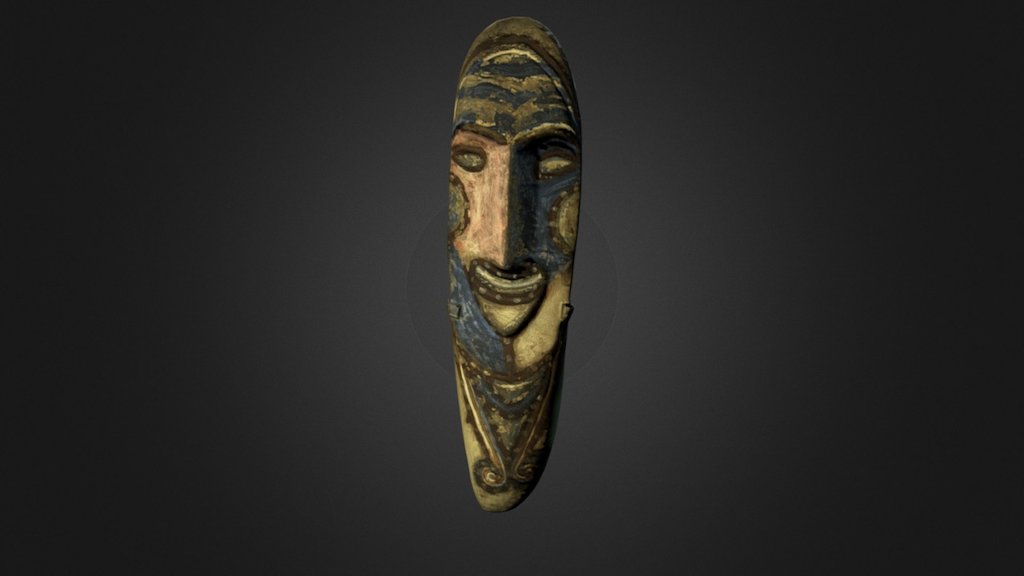
At what (x,y) coordinates should I click in order to perform the action: click on figurine. Please return your answer as a coordinate pair (x, y). The height and width of the screenshot is (576, 1024). Looking at the image, I should click on (538, 341).